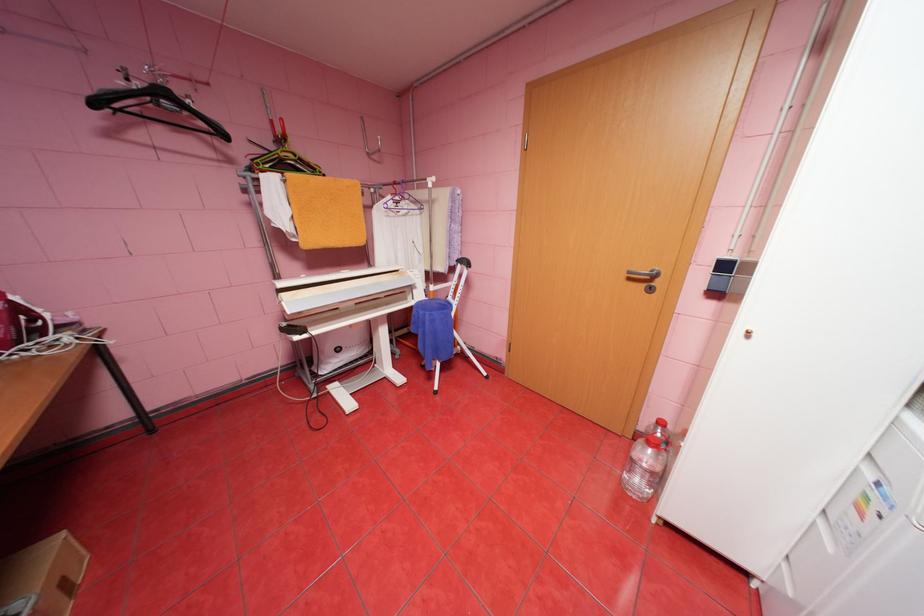
The image size is (924, 616). Identify the location of metal wall hook. (369, 140).